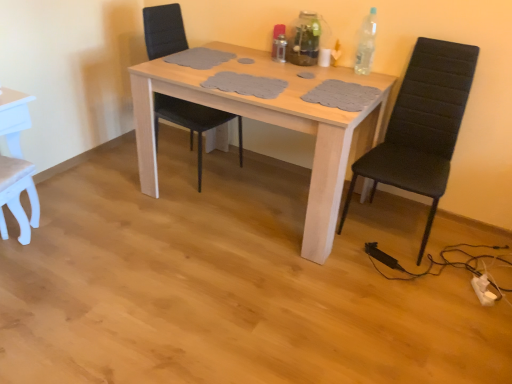
The image size is (512, 384). What are the coordinates of `empty space that is to the right of transparent glass vase at upper center, arranged as the 2th bottle when viewed from the right` in the screenshot? It's located at (339, 71).